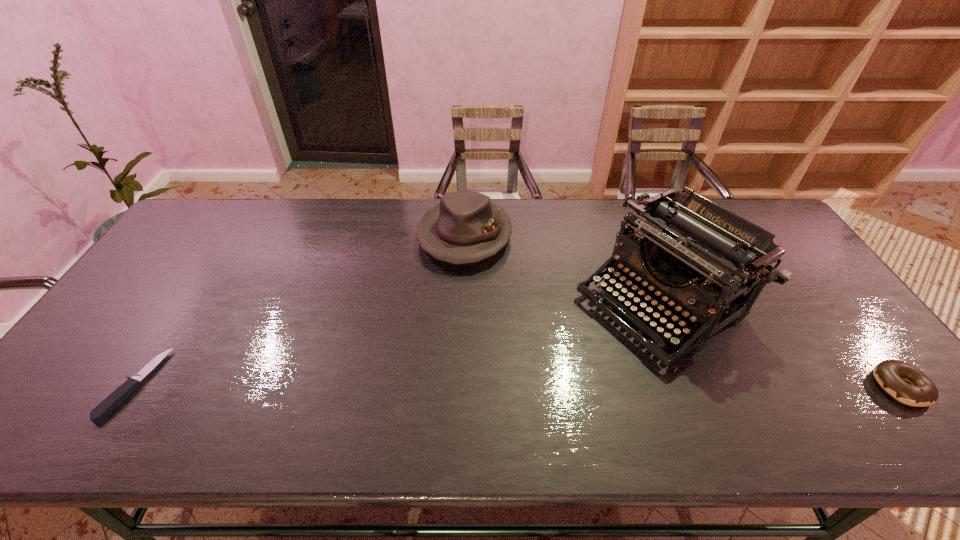
At what (x,y) coordinates should I click in order to perform the action: click on free region that satisfies the following two spatial constraints: 1. on the front side of the leftmost object; 2. on the left side of the second shortest object. Please return your answer as a coordinate pair (x, y). Looking at the image, I should click on (133, 387).

Locate an element on the screen. vacant space that satisfies the following two spatial constraints: 1. on the front side of the shortest object; 2. on the right side of the doughnut is located at coordinates (133, 387).